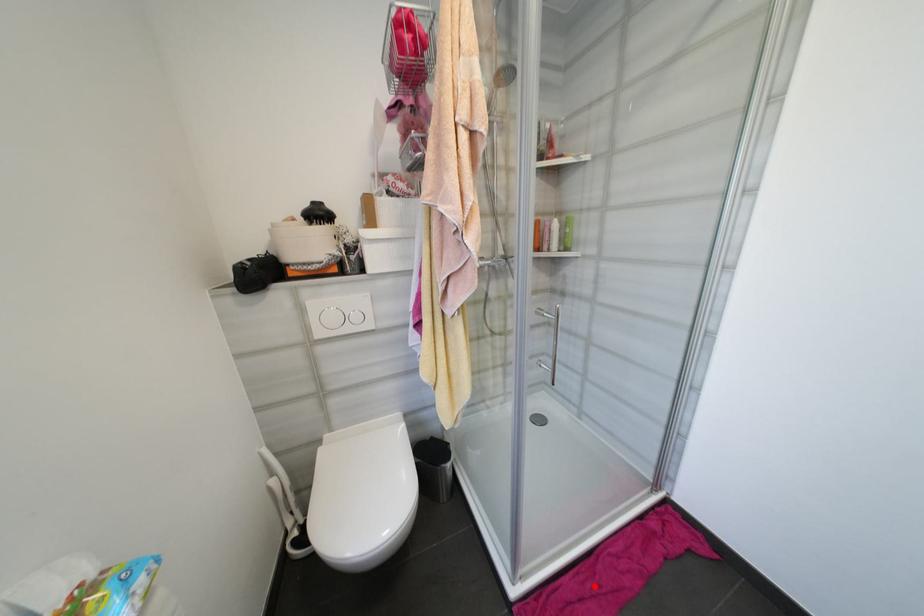
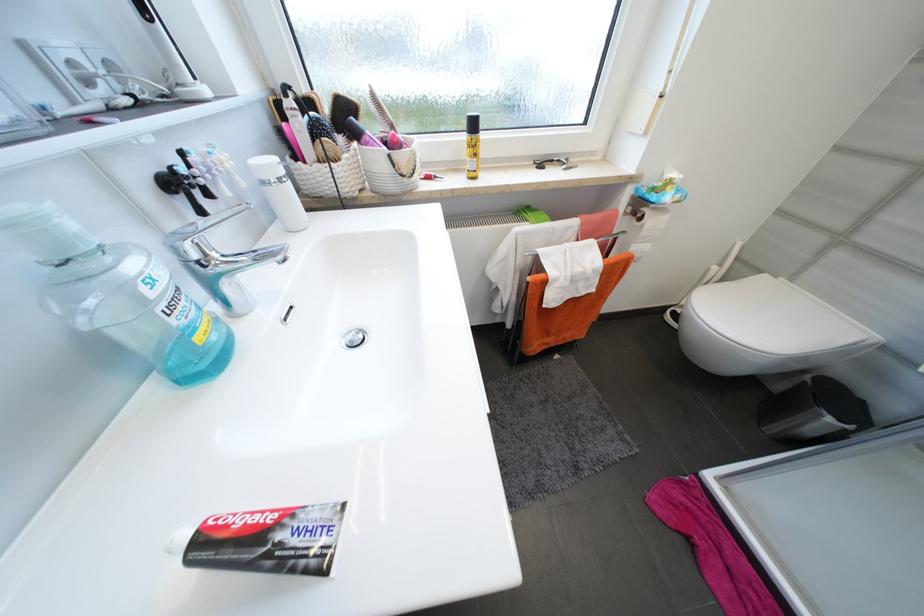
Locate, in the second image, the point that corresponds to the highlighted location in the first image.

(759, 596)